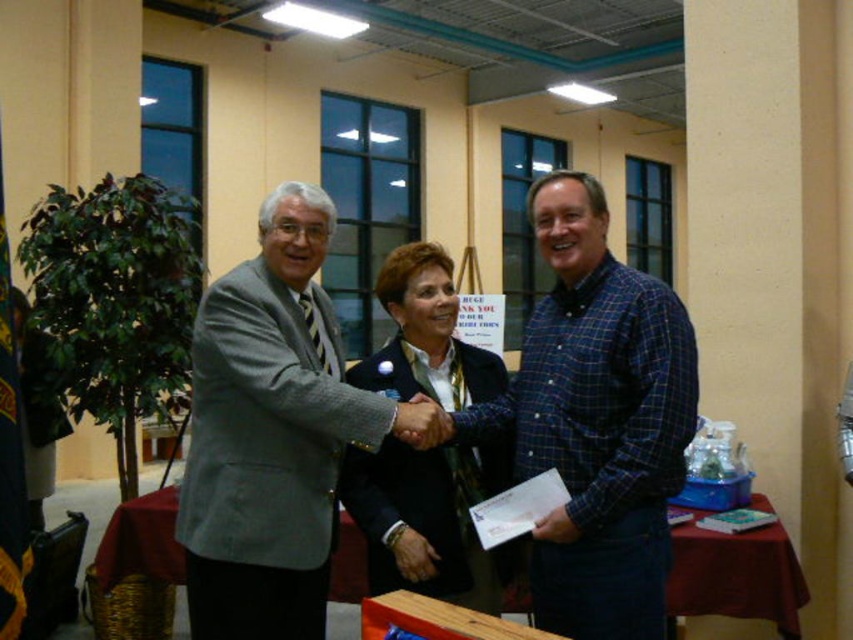
Based on the scene description, where is the wooden table at center located in terms of coordinates?

The wooden table at center is located at point [735,577].

You are arranging chairs for a meeting in the conference room. You need to place a chair that is 1.2 meters wide between the wooden table at center and the maroon fabric table at lower right. Can the chair fit between them?

The wooden table at center is thinner than the maroon fabric table at lower right, but the description does not provide specific measurements of the distance between them. Therefore, it is unclear if the chair will fit.

You are a photographer positioned at point (679, 408). You need to capture a photo of the three people shaking hands. Can you fit all three of them in your camera frame which has a 1.8 meter width?

The three people are 1.75 meters apart, so yes, the photographer can fit all three of them in the camera frame since the distance between them is less than the frame width of 1.8 meters.